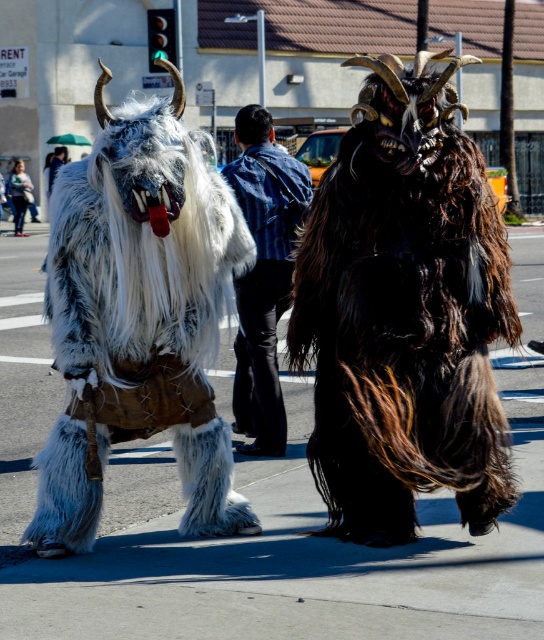
From the picture: Is white furry bull at center wider than denim jacket at upper center?

Incorrect, white furry bull at center's width does not surpass denim jacket at upper center's.

Between white furry bull at center and denim jacket at upper center, which one appears on the left side from the viewer's perspective?

From the viewer's perspective, denim jacket at upper center appears more on the left side.

Locate an element on the screen. The image size is (544, 640). white furry bull at center is located at coordinates (139, 317).

Between point (293, 328) and point (22, 211), which one is positioned in front?

Positioned in front is point (293, 328).

Between shaggy fur costume at center and denim jacket at upper center, which one has less height?

Standing shorter between the two is denim jacket at upper center.

You are a GUI agent. You are given a task and a screenshot of the screen. Output one action in this format:
    pyautogui.click(x=<x>, y=<y>)
    Task: Click on the shaggy fur costume at center
    The width and height of the screenshot is (544, 640).
    Given the screenshot: What is the action you would take?
    pyautogui.click(x=404, y=314)

Is the position of shaggy fur costume at center more distant than that of white furry bull at center?

No, shaggy fur costume at center is closer to the viewer.

Does point (398, 404) come farther from viewer compared to point (174, 196)?

That is False.

Identify the location of shaggy fur costume at center. The height and width of the screenshot is (640, 544). (404, 314).